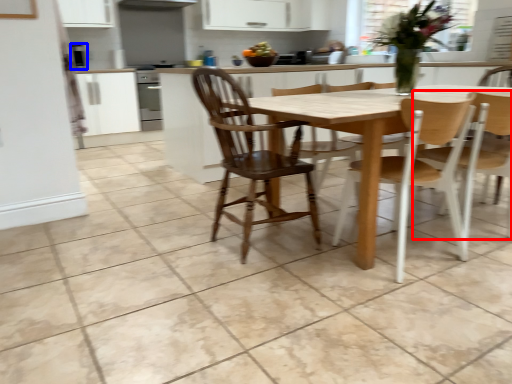
Question: Among these objects, which one is farthest to the camera, chair (highlighted by a red box) or appliance (highlighted by a blue box)?

Choices:
 (A) chair
 (B) appliance

Answer: (B)